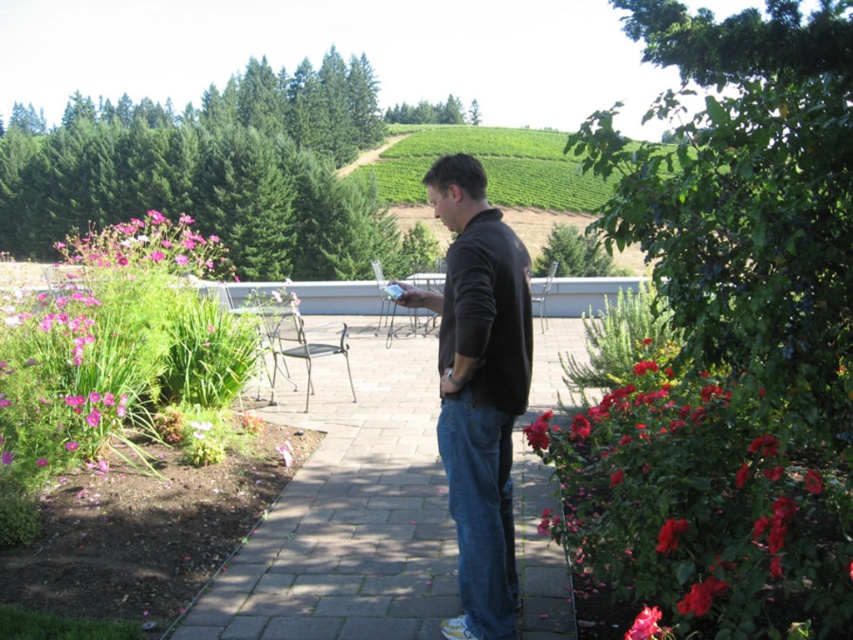
Question: Is denim jeans at center thinner than red matte rose at center right?

Choices:
 (A) no
 (B) yes

Answer: (A)

Question: Which of these objects is positioned farthest from the vivid red petals at center right?

Choices:
 (A) pink matte flowers at left
 (B) dark brown leather jacket at center
 (C) denim jeans at center
 (D) red matte rose bush at lower right

Answer: (A)

Question: Which is farther from the dark brown leather jacket at center?

Choices:
 (A) pink matte flowers at upper left
 (B) denim jeans at center

Answer: (A)

Question: Where is denim jeans at center located in relation to smooth pink rose at center right in the image?

Choices:
 (A) right
 (B) left

Answer: (B)

Question: Does pink matte flowers at left have a lesser width compared to vivid red petals at center right?

Choices:
 (A) no
 (B) yes

Answer: (A)

Question: Which point is farther from the camera taking this photo?

Choices:
 (A) (55, 451)
 (B) (213, 246)

Answer: (B)